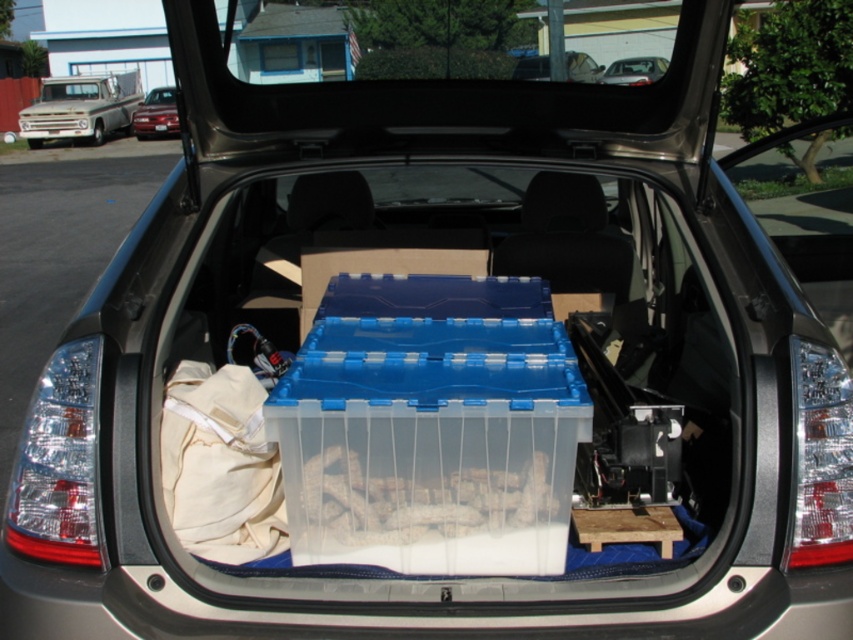
You are standing in front of the car trunk and want to locate the shiny red sedan at upper left. Where exactly should you look?

You should look at point [155,113] to find the shiny red sedan at upper left.

You are trying to determine if the shiny red sedan at upper left can fit into a parking space that is only as wide as the matte blue plastic container at center. Based on their sizes, what do you think?

The shiny red sedan at upper left is larger in size than the matte blue plastic container at center. Since the parking space is only as wide as the container, the sedan would not fit into the parking space.

You are standing in front of the car trunk and want to place a new item in the trunk. The new item must be placed to the right of the point represented by point (80, 108). Where should you place it?

The point (80, 108) corresponds to the matte silver truck at upper left. To place the new item to the right of this point, you should position it to the right side of the matte silver truck at upper left within the trunk.